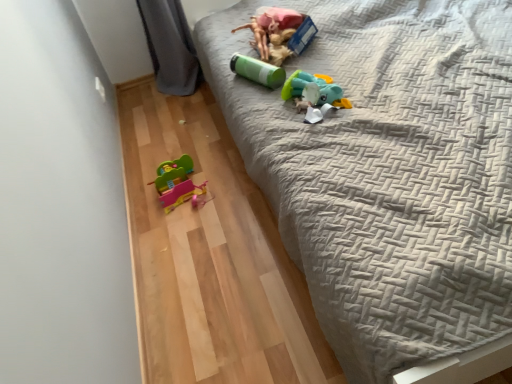
Question: Considering the relative sizes of green matte canister at upper center, which is the third toy from bottom to top, and gray quilted bed at upper right in the image provided, is green matte canister at upper center, which is the third toy from bottom to top, bigger than gray quilted bed at upper right?

Choices:
 (A) yes
 (B) no

Answer: (B)

Question: Is green matte canister at upper center, the second toy in the top-to-bottom sequence, oriented away from gray quilted bed at upper right?

Choices:
 (A) no
 (B) yes

Answer: (B)

Question: Considering the relative sizes of green matte canister at upper center, which is the third toy from bottom to top, and gray quilted bed at upper right in the image provided, is green matte canister at upper center, which is the third toy from bottom to top, wider than gray quilted bed at upper right?

Choices:
 (A) no
 (B) yes

Answer: (A)

Question: Is green matte canister at upper center, which is the third toy from bottom to top, positioned far away from gray quilted bed at upper right?

Choices:
 (A) yes
 (B) no

Answer: (B)

Question: Considering the relative positions of green matte canister at upper center, the second toy in the top-to-bottom sequence, and gray quilted bed at upper right in the image provided, is green matte canister at upper center, the second toy in the top-to-bottom sequence, in front of gray quilted bed at upper right?

Choices:
 (A) yes
 (B) no

Answer: (B)

Question: Can you confirm if green matte canister at upper center, the second toy in the top-to-bottom sequence, is shorter than gray quilted bed at upper right?

Choices:
 (A) no
 (B) yes

Answer: (B)

Question: From a real-world perspective, is matte green plastic cup at upper center, which is the first toy in top-to-bottom order, positioned over gray quilted bed at upper right based on gravity?

Choices:
 (A) yes
 (B) no

Answer: (A)

Question: Is matte green plastic cup at upper center, which is the first toy in top-to-bottom order, aimed at gray quilted bed at upper right?

Choices:
 (A) no
 (B) yes

Answer: (B)

Question: Is matte green plastic cup at upper center, which is the first toy in top-to-bottom order, not close to gray quilted bed at upper right?

Choices:
 (A) no
 (B) yes

Answer: (A)

Question: From a real-world perspective, is matte green plastic cup at upper center, the 4th toy from the bottom, physically below gray quilted bed at upper right?

Choices:
 (A) no
 (B) yes

Answer: (A)

Question: Is the position of matte green plastic cup at upper center, the 4th toy from the bottom, less distant than that of gray quilted bed at upper right?

Choices:
 (A) yes
 (B) no

Answer: (B)

Question: Considering the relative sizes of matte green plastic cup at upper center, which is the first toy in top-to-bottom order, and gray quilted bed at upper right in the image provided, is matte green plastic cup at upper center, which is the first toy in top-to-bottom order, shorter than gray quilted bed at upper right?

Choices:
 (A) yes
 (B) no

Answer: (A)

Question: Is gray quilted bed at upper right turned away from teal matte plush toy at upper center, acting as the third toy starting from the top?

Choices:
 (A) no
 (B) yes

Answer: (A)